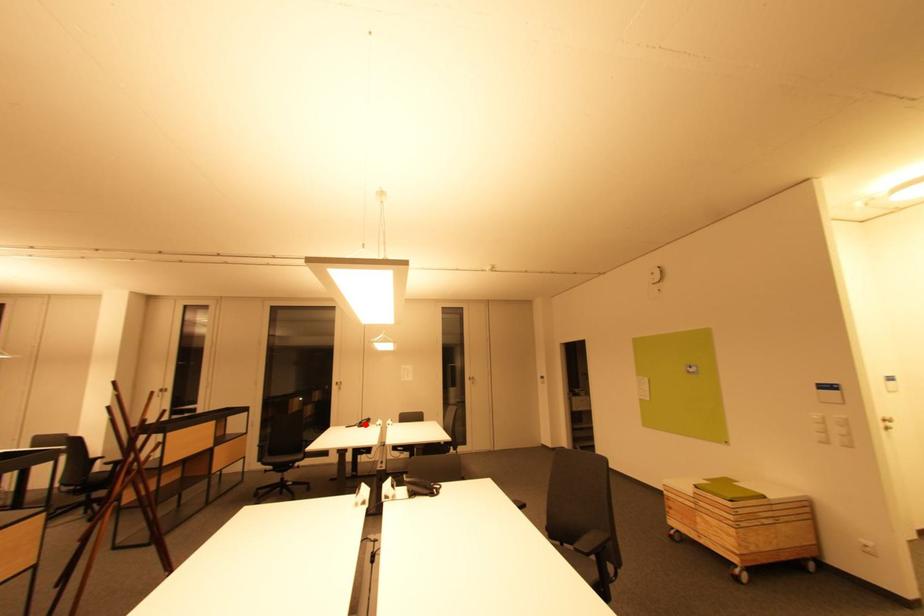
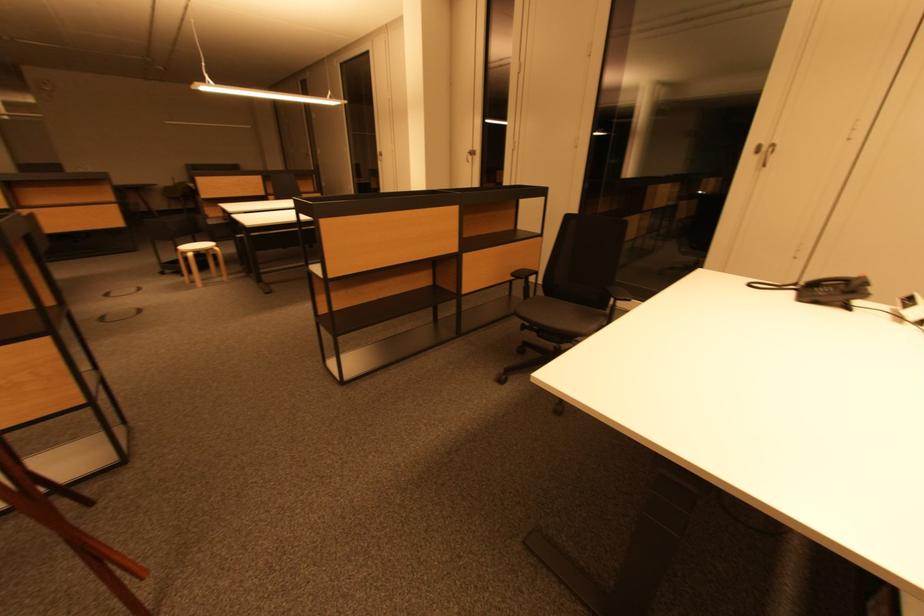
Find the pixel in the second image that matches the highlighted location in the first image.

(819, 286)